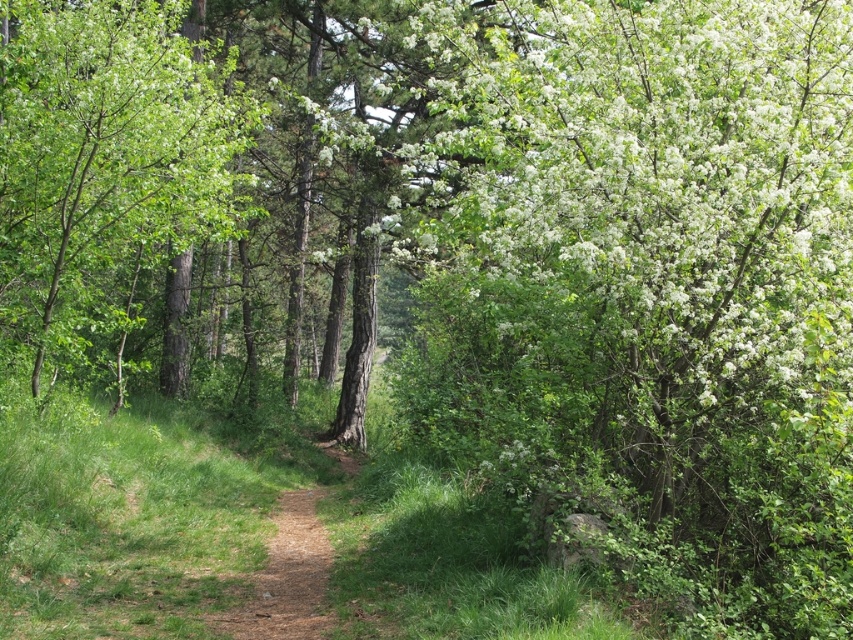
Does green matte tree at center have a greater height compared to brown dirt path at center?

Correct, green matte tree at center is much taller as brown dirt path at center.

Does green matte tree at center appear on the left side of brown dirt path at center?

Yes, green matte tree at center is to the left of brown dirt path at center.

Does point (170, 349) lie in front of point (292, 616)?

That is False.

Identify the location of green matte tree at center. The width and height of the screenshot is (853, 640). (106, 168).